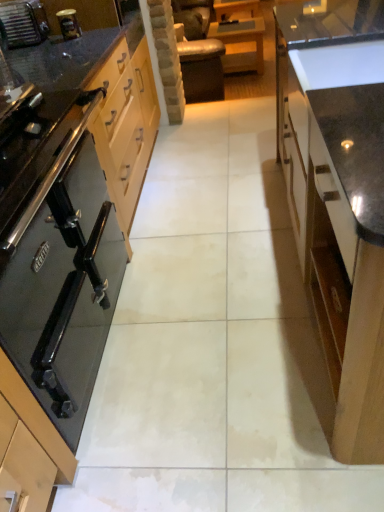
In order to face wooden table at center, should I rotate leftwards or rightwards?

Rotate your view right by about 6.065°.

Identify the location of glossy wood cabinet at right, which ranks as the first cabinetry in right-to-left order. The height and width of the screenshot is (512, 384). (339, 200).

Image resolution: width=384 pixels, height=512 pixels. What do you see at coordinates (64, 234) in the screenshot?
I see `black glass stove at left, which is the first cabinetry from left to right` at bounding box center [64, 234].

This screenshot has width=384, height=512. In order to click on brushed metal toaster at upper left in this screenshot , I will do `click(23, 23)`.

Describe the element at coordinates (23, 23) in the screenshot. This screenshot has width=384, height=512. I see `brushed metal toaster at upper left` at that location.

Find the location of a particular element. This screenshot has width=384, height=512. wooden table at center is located at coordinates (241, 42).

Is brushed metal toaster at upper left inside or outside of glossy wood cabinet at right, which ranks as the first cabinetry in right-to-left order?

The correct answer is: outside.

From a real-world perspective, between brushed metal toaster at upper left and glossy wood cabinet at right, which is the second cabinetry from left to right, who is vertically higher?

brushed metal toaster at upper left.

Is brushed metal toaster at upper left facing towards glossy wood cabinet at right, which is the second cabinetry from left to right?

No.

Which of these two, brushed metal toaster at upper left or glossy wood cabinet at right, which is the second cabinetry from left to right, is bigger?

With larger size is glossy wood cabinet at right, which is the second cabinetry from left to right.

Is glossy wood cabinet at right, which is the second cabinetry from left to right, aimed at brushed metal toaster at upper left?

No, glossy wood cabinet at right, which is the second cabinetry from left to right, is not oriented towards brushed metal toaster at upper left.

Measure the distance between glossy wood cabinet at right, which ranks as the first cabinetry in right-to-left order, and brushed metal toaster at upper left.

glossy wood cabinet at right, which ranks as the first cabinetry in right-to-left order, is 5.15 feet from brushed metal toaster at upper left.

Is glossy wood cabinet at right, which ranks as the first cabinetry in right-to-left order, taller than brushed metal toaster at upper left?

Correct, glossy wood cabinet at right, which ranks as the first cabinetry in right-to-left order, is much taller as brushed metal toaster at upper left.

Is glossy wood cabinet at right, which ranks as the first cabinetry in right-to-left order, far from brushed metal toaster at upper left?

Absolutely, glossy wood cabinet at right, which ranks as the first cabinetry in right-to-left order, is distant from brushed metal toaster at upper left.

In terms of size, does black glass stove at left, which is counted as the 2th cabinetry, starting from the right, appear bigger or smaller than wooden table at center?

In the image, black glass stove at left, which is counted as the 2th cabinetry, starting from the right, appears to be larger than wooden table at center.

Is wooden table at center at the back of black glass stove at left, which is counted as the 2th cabinetry, starting from the right?

No, black glass stove at left, which is counted as the 2th cabinetry, starting from the right, is not facing away from wooden table at center.

Can you tell me how much black glass stove at left, which is counted as the 2th cabinetry, starting from the right, and wooden table at center differ in facing direction?

black glass stove at left, which is counted as the 2th cabinetry, starting from the right, and wooden table at center are facing 2.03 degrees away from each other.

Is black glass stove at left, which is counted as the 2th cabinetry, starting from the right, not close to wooden table at center?

Yes.

Considering the sizes of objects brushed metal toaster at upper left and black glass stove at left, which is the first cabinetry from left to right, in the image provided, who is taller, brushed metal toaster at upper left or black glass stove at left, which is the first cabinetry from left to right,?

black glass stove at left, which is the first cabinetry from left to right, is taller.

Does brushed metal toaster at upper left have a lesser width compared to black glass stove at left, which is counted as the 2th cabinetry, starting from the right?

Correct, the width of brushed metal toaster at upper left is less than that of black glass stove at left, which is counted as the 2th cabinetry, starting from the right.

Is brushed metal toaster at upper left far away from black glass stove at left, which is the first cabinetry from left to right?

brushed metal toaster at upper left is actually quite close to black glass stove at left, which is the first cabinetry from left to right.

Is black glass stove at left, which is counted as the 2th cabinetry, starting from the right, bigger or smaller than glossy wood cabinet at right, which is the second cabinetry from left to right?

In the image, black glass stove at left, which is counted as the 2th cabinetry, starting from the right, appears to be smaller than glossy wood cabinet at right, which is the second cabinetry from left to right.

Is black glass stove at left, which is counted as the 2th cabinetry, starting from the right, oriented away from glossy wood cabinet at right, which ranks as the first cabinetry in right-to-left order?

That's not correct — black glass stove at left, which is counted as the 2th cabinetry, starting from the right, is not looking away from glossy wood cabinet at right, which ranks as the first cabinetry in right-to-left order.

Visually, is black glass stove at left, which is counted as the 2th cabinetry, starting from the right, positioned to the left or to the right of glossy wood cabinet at right, which ranks as the first cabinetry in right-to-left order?

Based on their positions, black glass stove at left, which is counted as the 2th cabinetry, starting from the right, is located to the left of glossy wood cabinet at right, which ranks as the first cabinetry in right-to-left order.

Locate an element on the screen. cabinetry that appears below the glossy wood cabinet at right, which ranks as the first cabinetry in right-to-left order (from a real-world perspective) is located at coordinates (64, 234).

Does glossy wood cabinet at right, which ranks as the first cabinetry in right-to-left order, have a lesser width compared to black glass stove at left, which is counted as the 2th cabinetry, starting from the right?

Indeed, glossy wood cabinet at right, which ranks as the first cabinetry in right-to-left order, has a lesser width compared to black glass stove at left, which is counted as the 2th cabinetry, starting from the right.

Is glossy wood cabinet at right, which ranks as the first cabinetry in right-to-left order, to the left of black glass stove at left, which is the first cabinetry from left to right, from the viewer's perspective?

Answer: No.

Considering the positions of point (337, 234) and point (49, 326), is point (337, 234) closer or farther from the camera than point (49, 326)?

Clearly, point (337, 234) is closer to the camera than point (49, 326).

Which is more to the left, black glass stove at left, which is counted as the 2th cabinetry, starting from the right, or brushed metal toaster at upper left?

brushed metal toaster at upper left is more to the left.

Based on their sizes in the image, would you say black glass stove at left, which is the first cabinetry from left to right, is bigger or smaller than brushed metal toaster at upper left?

Considering their sizes, black glass stove at left, which is the first cabinetry from left to right, takes up more space than brushed metal toaster at upper left.

Where is `home appliance above the black glass stove at left, which is counted as the 2th cabinetry, starting from the right (from the image's perspective)`? home appliance above the black glass stove at left, which is counted as the 2th cabinetry, starting from the right (from the image's perspective) is located at coordinates (23, 23).

From a real-world perspective, who is located lower, black glass stove at left, which is the first cabinetry from left to right, or brushed metal toaster at upper left?

black glass stove at left, which is the first cabinetry from left to right, is physically lower.

This screenshot has height=512, width=384. Find the location of `home appliance located above the glossy wood cabinet at right, which is the second cabinetry from left to right (from a real-world perspective)`. home appliance located above the glossy wood cabinet at right, which is the second cabinetry from left to right (from a real-world perspective) is located at coordinates (23, 23).

From a real-world perspective, count 1st cabinetrys downward from the brushed metal toaster at upper left and point to it. Please provide its 2D coordinates.

[(339, 200)]

From the image, which object appears to be nearer to glossy wood cabinet at right, which ranks as the first cabinetry in right-to-left order, black glass stove at left, which is counted as the 2th cabinetry, starting from the right, or brushed metal toaster at upper left?

black glass stove at left, which is counted as the 2th cabinetry, starting from the right, is closer to glossy wood cabinet at right, which ranks as the first cabinetry in right-to-left order.

Consider the image. Looking at the image, which one is located closer to black glass stove at left, which is counted as the 2th cabinetry, starting from the right, glossy wood cabinet at right, which ranks as the first cabinetry in right-to-left order, or wooden table at center?

glossy wood cabinet at right, which ranks as the first cabinetry in right-to-left order.

Which object lies further to the anchor point brushed metal toaster at upper left, black glass stove at left, which is counted as the 2th cabinetry, starting from the right, or glossy wood cabinet at right, which is the second cabinetry from left to right?

glossy wood cabinet at right, which is the second cabinetry from left to right, lies further to brushed metal toaster at upper left than the other object.

When comparing their distances from wooden table at center, does black glass stove at left, which is the first cabinetry from left to right, or brushed metal toaster at upper left seem closer?

Among the two, brushed metal toaster at upper left is located nearer to wooden table at center.

Looking at the image, which one is located closer to brushed metal toaster at upper left, wooden table at center or black glass stove at left, which is counted as the 2th cabinetry, starting from the right?

black glass stove at left, which is counted as the 2th cabinetry, starting from the right, is positioned closer to the anchor brushed metal toaster at upper left.

In the scene shown: Based on their spatial positions, is black glass stove at left, which is counted as the 2th cabinetry, starting from the right, or glossy wood cabinet at right, which is the second cabinetry from left to right, closer to wooden table at center?

The object closer to wooden table at center is black glass stove at left, which is counted as the 2th cabinetry, starting from the right.

Considering their positions, is glossy wood cabinet at right, which ranks as the first cabinetry in right-to-left order, positioned further to black glass stove at left, which is the first cabinetry from left to right, than brushed metal toaster at upper left?

Based on the image, glossy wood cabinet at right, which ranks as the first cabinetry in right-to-left order, appears to be further to black glass stove at left, which is the first cabinetry from left to right.

Considering their positions, is wooden table at center positioned closer to glossy wood cabinet at right, which is the second cabinetry from left to right, than black glass stove at left, which is counted as the 2th cabinetry, starting from the right?

black glass stove at left, which is counted as the 2th cabinetry, starting from the right, is closer to glossy wood cabinet at right, which is the second cabinetry from left to right.

You are a GUI agent. You are given a task and a screenshot of the screen. Output one action in this format:
    pyautogui.click(x=<x>, y=<y>)
    Task: Click on the home appliance located between black glass stove at left, which is counted as the 2th cabinetry, starting from the right, and wooden table at center in the depth direction
    
    Given the screenshot: What is the action you would take?
    pyautogui.click(x=23, y=23)

Where is `cabinetry situated between brushed metal toaster at upper left and glossy wood cabinet at right, which ranks as the first cabinetry in right-to-left order, from left to right`? The image size is (384, 512). cabinetry situated between brushed metal toaster at upper left and glossy wood cabinet at right, which ranks as the first cabinetry in right-to-left order, from left to right is located at coordinates (64, 234).

Find the location of `cabinetry between glossy wood cabinet at right, which is the second cabinetry from left to right, and wooden table at center, along the z-axis`. cabinetry between glossy wood cabinet at right, which is the second cabinetry from left to right, and wooden table at center, along the z-axis is located at coordinates pos(64,234).

Identify the location of home appliance between glossy wood cabinet at right, which ranks as the first cabinetry in right-to-left order, and wooden table at center, along the z-axis. The image size is (384, 512). (23, 23).